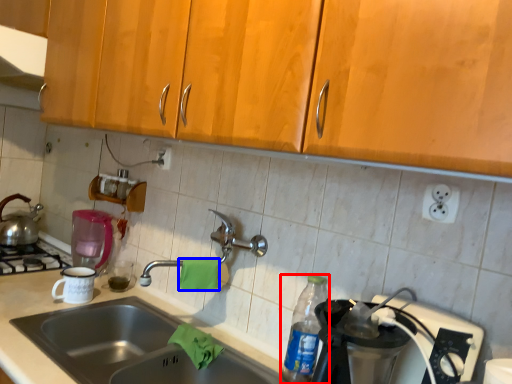
Question: Which object is closer to the camera taking this photo, bottle (highlighted by a red box) or material (highlighted by a blue box)?

Choices:
 (A) bottle
 (B) material

Answer: (A)